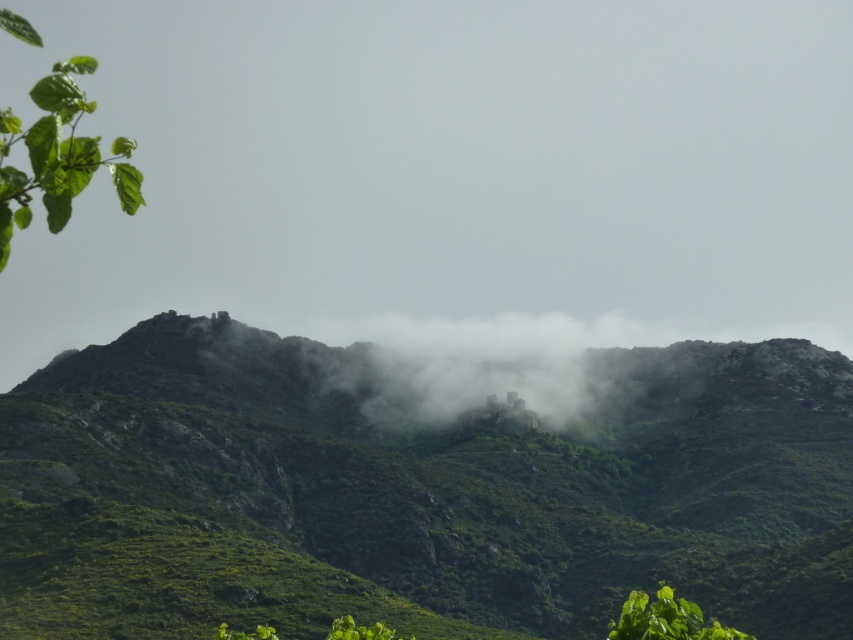
Question: Is foggy misty castle at center thinner than green leafy branch at upper left?

Choices:
 (A) no
 (B) yes

Answer: (B)

Question: Which of these objects is positioned closest to the foggy misty castle at center?

Choices:
 (A) green leafy plant at lower right
 (B) green rocky mountain at upper center
 (C) green leafy branch at upper left

Answer: (B)

Question: Which point appears closest to the camera in this image?

Choices:
 (A) (119, 182)
 (B) (433, 328)
 (C) (711, 349)
 (D) (636, 616)

Answer: (A)

Question: Can you confirm if foggy misty castle at center is positioned to the right of green leafy plant at lower right?

Choices:
 (A) no
 (B) yes

Answer: (A)

Question: Does green rocky mountain at upper center have a larger size compared to green leafy branch at upper left?

Choices:
 (A) yes
 (B) no

Answer: (B)

Question: Which object appears farthest from the camera in this image?

Choices:
 (A) green leafy plant at lower right
 (B) foggy misty castle at center
 (C) green rocky mountain at upper center
 (D) green leafy branch at upper left

Answer: (B)